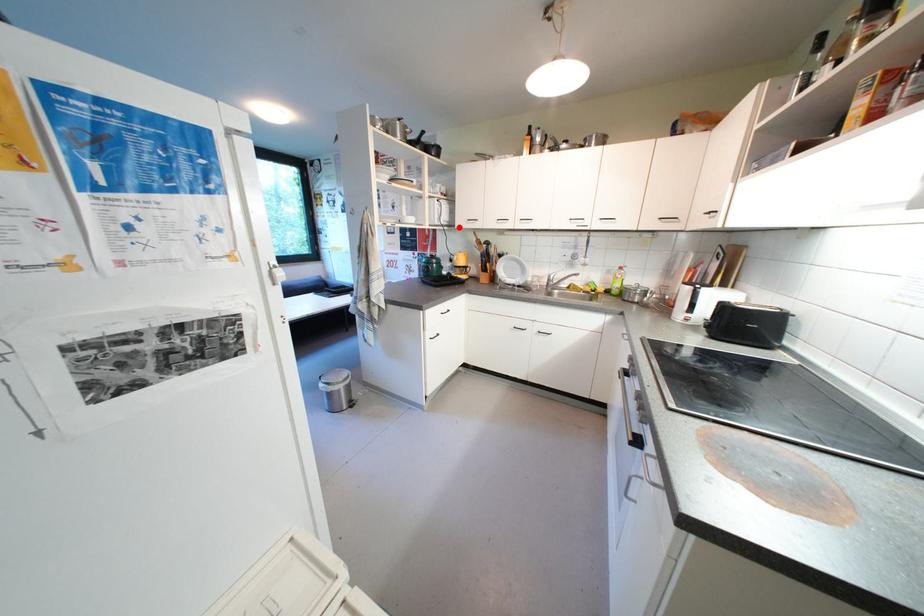
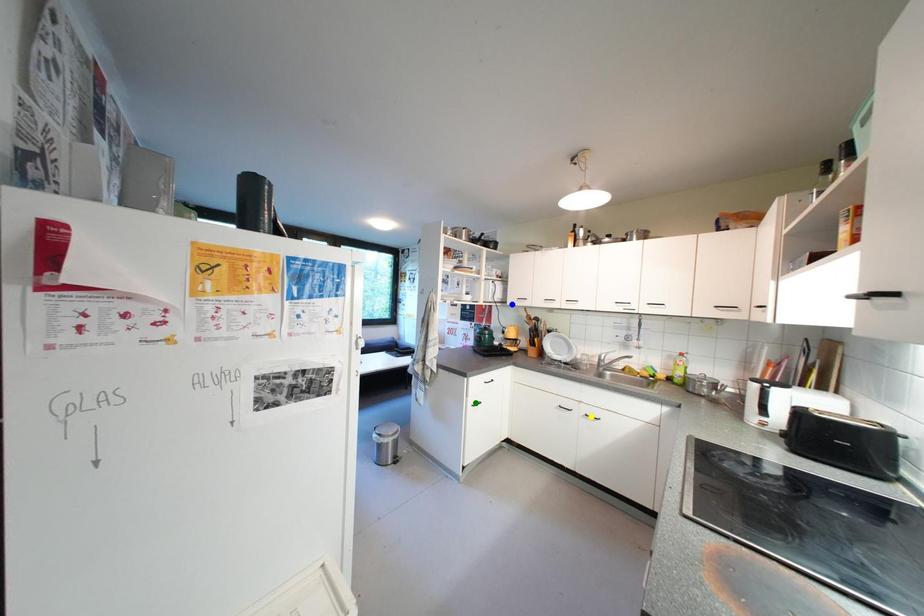
Question: I am providing you with two images of the same scene from different viewpoints. A red point is marked on the first image. You are given multiple points on the second image. Can you choose the point in image 2 that corresponds to the point in image 1?

Choices:
 (A) green point
 (B) yellow point
 (C) blue point

Answer: (C)